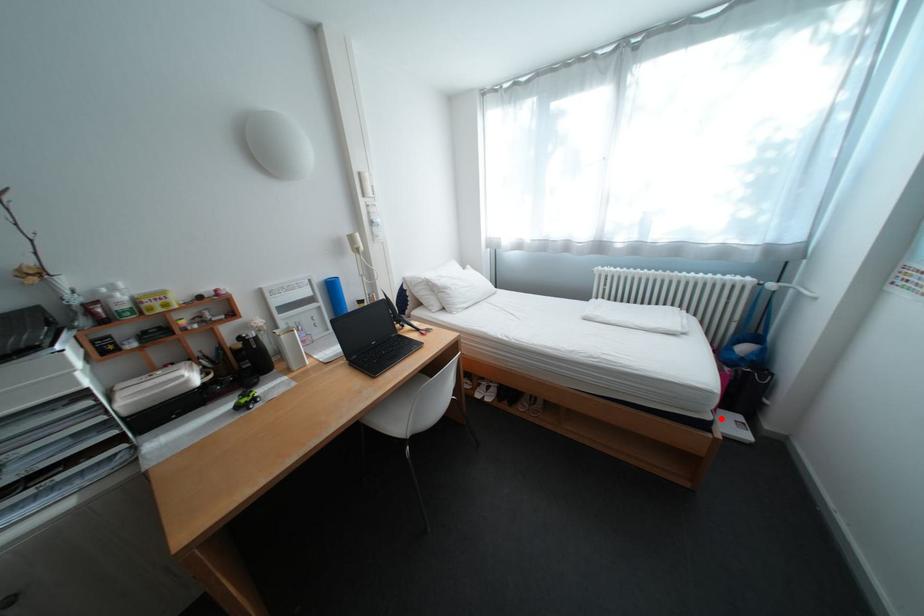
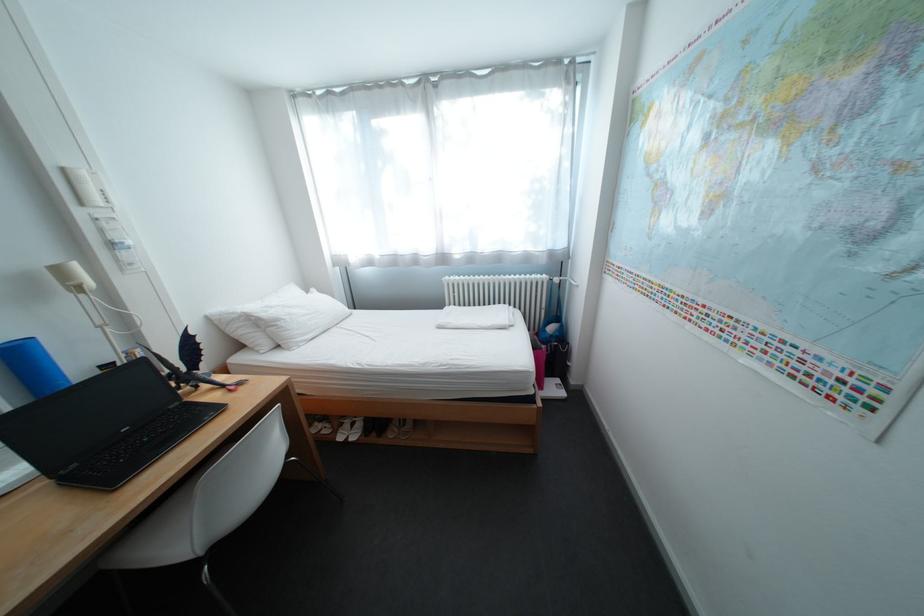
Question: I am providing you with two images of the same scene from different viewpoints. In image1, a red point is highlighted. Considering the same 3D point in image2, which of the following is correct?

Choices:
 (A) It is closer
 (B) It is farther

Answer: (B)